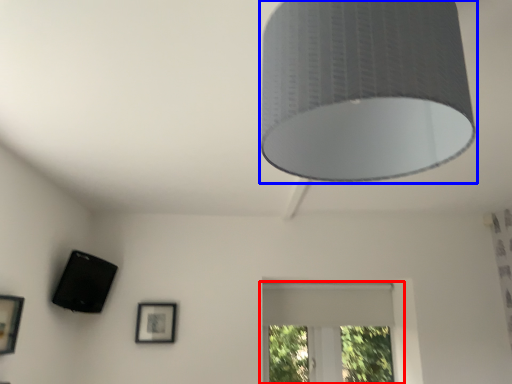
Question: Which object appears farthest to the camera in this image, window (highlighted by a red box) or lamp (highlighted by a blue box)?

Choices:
 (A) window
 (B) lamp

Answer: (A)